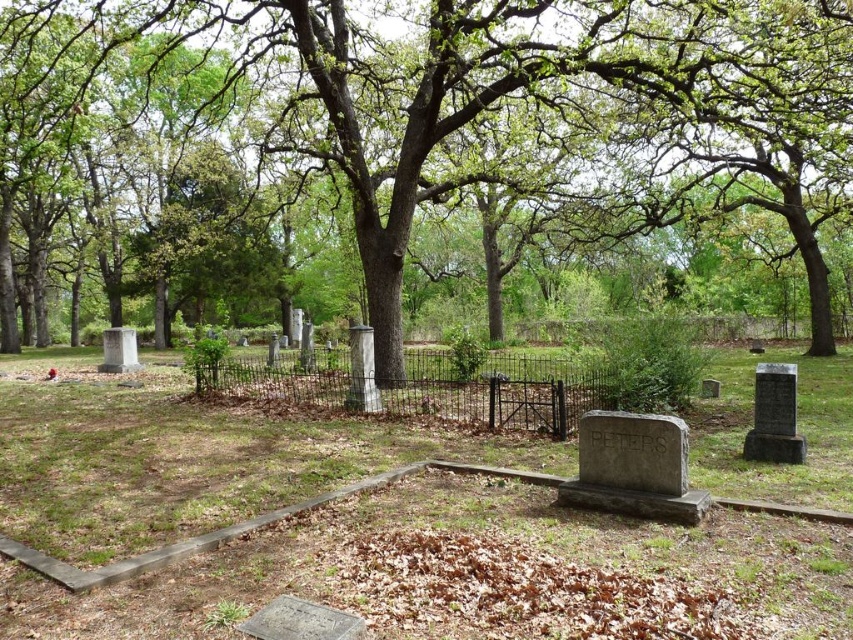
What is the relationship between the height of the gray stone marker at center and the green leafy tree at center in the cemetery scene?

The gray stone marker at center is not as tall as the green leafy tree at center.

You are standing at the entrance of the cemetery and want to take a photo of both the point at coordinates (260, 413) and the point at (399, 193). Which point will appear larger in your photo?

Point at coordinates (260, 413) will appear larger in the photo because it is closer to the camera than point at coordinates (399, 193).

You are standing at the entrance of the cemetery and see the gray stone marker at center. According to the coordinates provided, is the marker closer to the top or bottom of the image?

The gray stone marker at center is located at point 0.714 on the x axis and 0.224 on the y axis. Since the y coordinate is lower, it is closer to the bottom of the image.